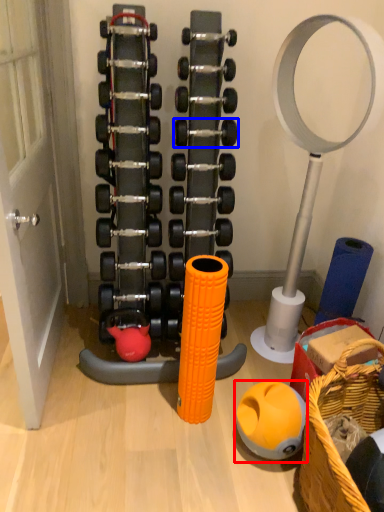
Question: Among these objects, which one is nearest to the camera, ball (highlighted by a red box) or dumbbell (highlighted by a blue box)?

Choices:
 (A) ball
 (B) dumbbell

Answer: (A)